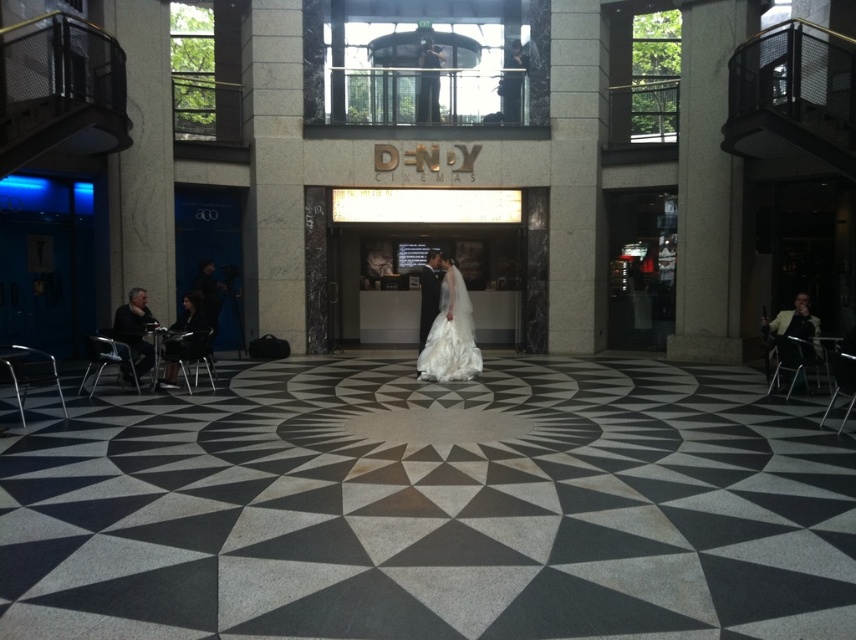
Question: Does matte black dress at lower left have a smaller size compared to light brown leather chair at right?

Choices:
 (A) no
 (B) yes

Answer: (A)

Question: Which point appears closest to the camera in this image?

Choices:
 (A) (193, 342)
 (B) (437, 321)
 (C) (140, 364)

Answer: (C)

Question: Does black textured carpet at center appear on the right side of light brown leather chair at right?

Choices:
 (A) no
 (B) yes

Answer: (A)

Question: Can you confirm if matte black dress at lower left is smaller than light brown leather chair at right?

Choices:
 (A) yes
 (B) no

Answer: (B)

Question: Which object appears closest to the camera in this image?

Choices:
 (A) black leather jacket at lower left
 (B) light brown leather chair at right
 (C) matte black dress at lower left

Answer: (C)

Question: Which is farther from the matte black dress at lower left?

Choices:
 (A) black textured carpet at center
 (B) white satin dress at center
 (C) dark gray fabric jacket at left
 (D) black leather jacket at lower left

Answer: (A)